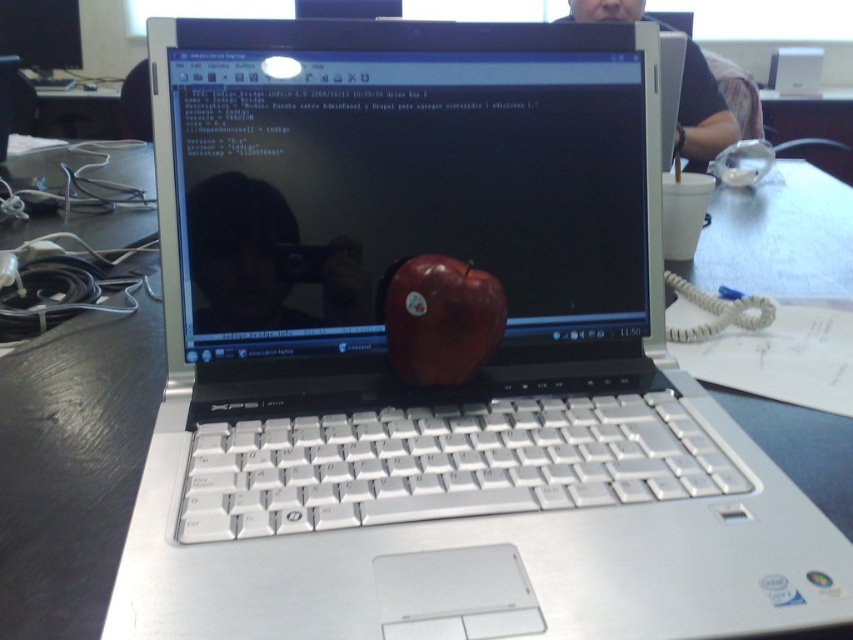
You are organizing items on a desk and need to place both the shiny red apple at center and the matte black laptop at center without overlapping. Given their sizes, which object should you place first to ensure there is enough space for both?

The shiny red apple at center has a lesser width compared to the matte black laptop at center, so you should place the matte black laptop at center first to ensure there is enough space for both.

You are standing in front of the table with the silver Dell XPS laptop. There are two points marked on the table. The first point is at coordinates point (268, 44) and the second point is at coordinates point (428, 364). Which point is closer to you?

Point (268, 44) is closer to you because it is further to the viewer than point (428, 364).